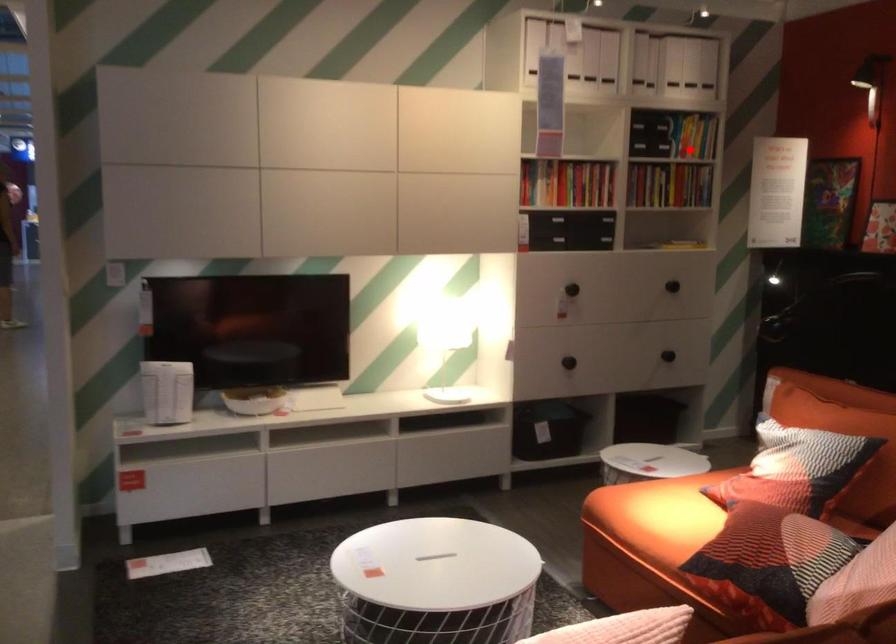
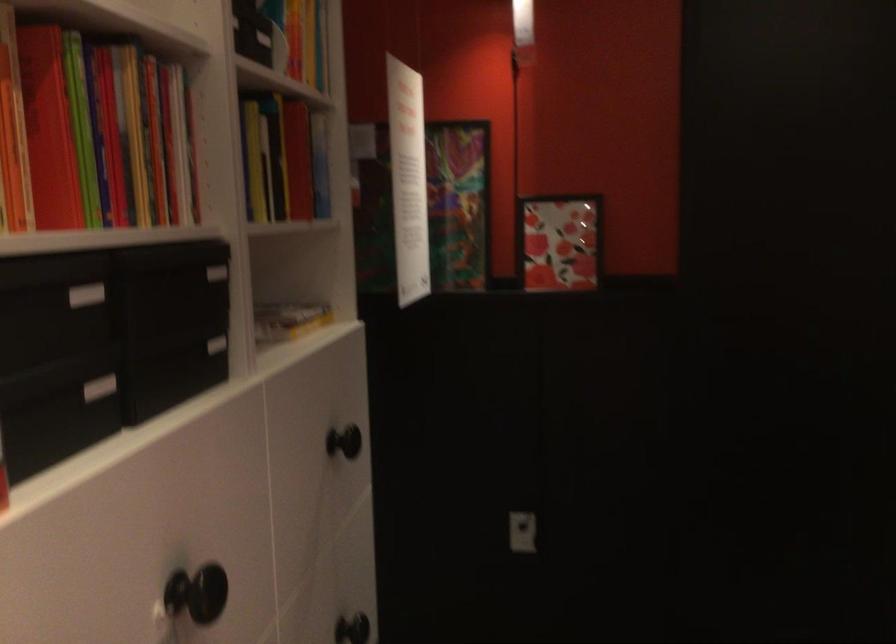
Find the pixel in the second image that matches the highlighted location in the first image.

(282, 158)